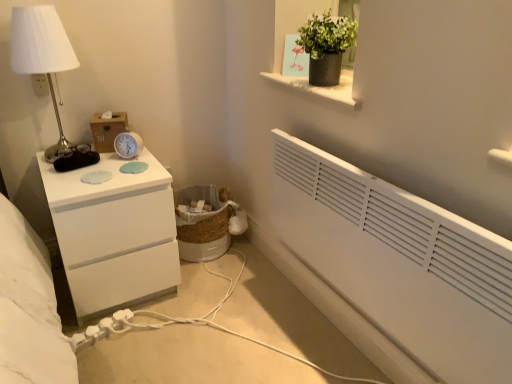
Locate an element on the screen. free location to the right of white plastic extension cord at lower left is located at coordinates (147, 342).